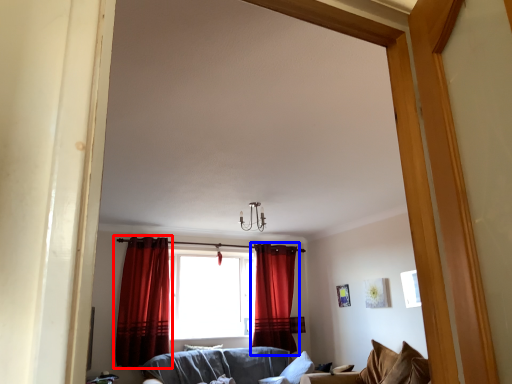
Question: Which point is closer to the camera, curtain (highlighted by a red box) or curtain (highlighted by a blue box)?

Choices:
 (A) curtain
 (B) curtain

Answer: (A)